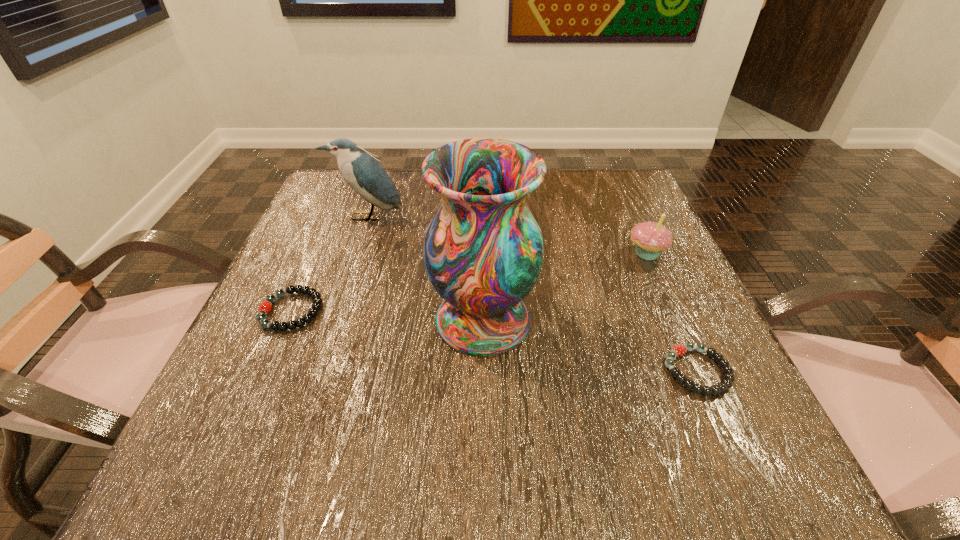
Identify the location of vacant space positioned 0.150m on the back of the third shortest object. (624, 203).

I want to click on free region located on the right of the farther bracelet, so click(462, 311).

Where is `vacant point located 0.170m on the back of the nearer bracelet`? This screenshot has height=540, width=960. vacant point located 0.170m on the back of the nearer bracelet is located at coordinates 656,278.

This screenshot has width=960, height=540. I want to click on object that is at the far edge, so click(x=364, y=174).

This screenshot has height=540, width=960. In order to click on bird located at the left edge in this screenshot , I will do `click(364, 174)`.

Identify the location of bracelet positioned at the left edge. The height and width of the screenshot is (540, 960). (265, 307).

Where is `cupcake at the right edge`? This screenshot has height=540, width=960. cupcake at the right edge is located at coordinates [650, 238].

In order to click on bracelet that is at the right edge in this screenshot , I will do `click(678, 350)`.

Locate an element on the screen. object at the far left corner is located at coordinates (364, 174).

Locate an element on the screen. Image resolution: width=960 pixels, height=540 pixels. free space at the far edge of the desktop is located at coordinates (406, 198).